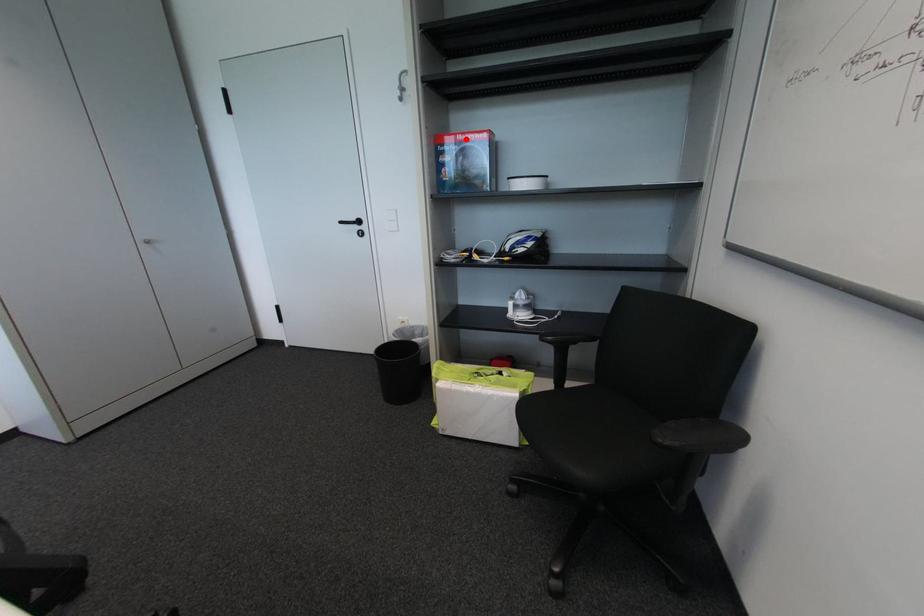
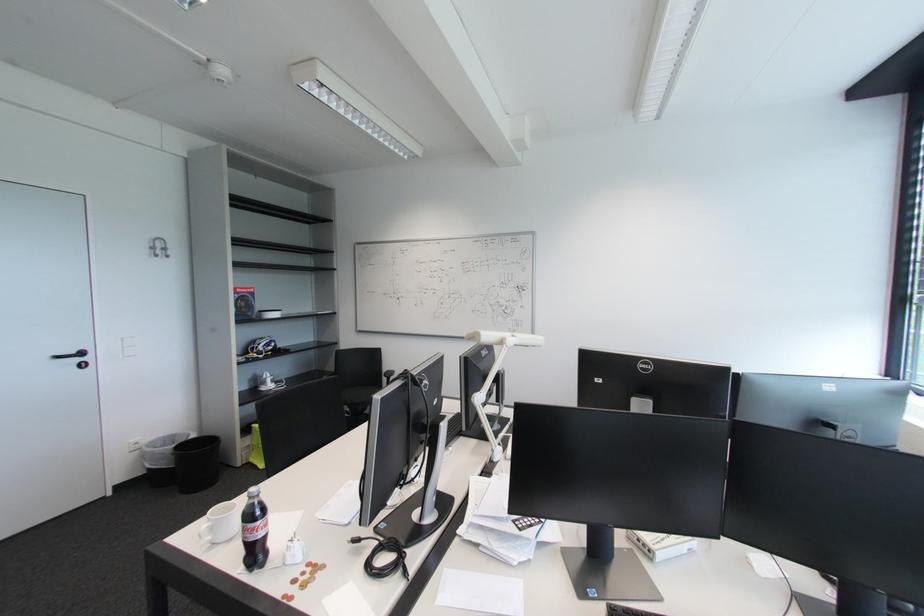
Locate, in the second image, the point that corresponds to the highlighted location in the first image.

(246, 292)